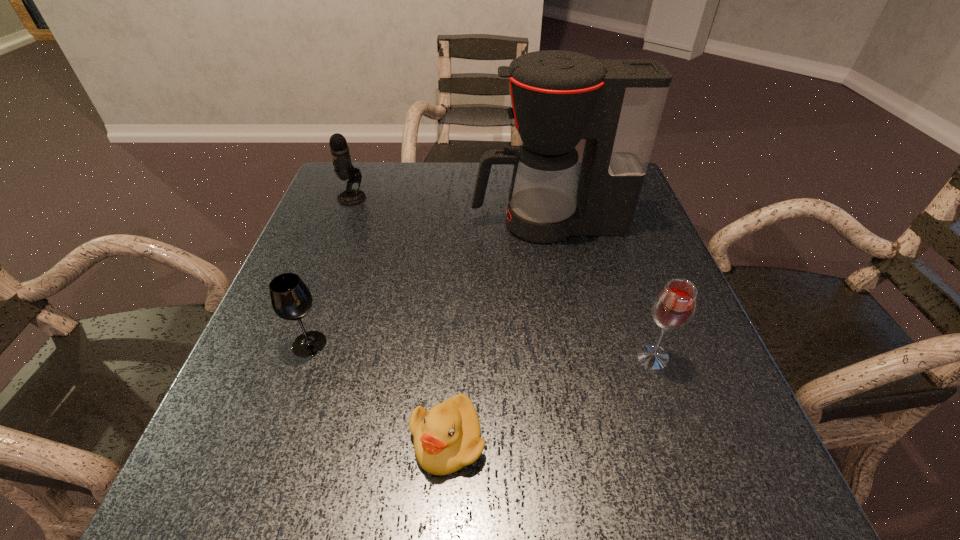
Where is `vacant space located on the left of the right wineglass`? The image size is (960, 540). vacant space located on the left of the right wineglass is located at coordinates (423, 357).

I want to click on vacant area located on the front of the left wineglass, so pyautogui.click(x=284, y=413).

The height and width of the screenshot is (540, 960). I want to click on free location located on the front-facing side of the shortest object, so click(444, 515).

Where is `coffee maker that is at the far edge`? coffee maker that is at the far edge is located at coordinates (558, 97).

Locate an element on the screen. The image size is (960, 540). microphone located in the far edge section of the desktop is located at coordinates (344, 169).

You are a GUI agent. You are given a task and a screenshot of the screen. Output one action in this format:
    pyautogui.click(x=<x>, y=<y>)
    Task: Click on the object that is at the near edge
    The height and width of the screenshot is (540, 960).
    Given the screenshot: What is the action you would take?
    pyautogui.click(x=447, y=438)

Identify the location of microphone at the left edge. (344, 169).

This screenshot has height=540, width=960. What are the coordinates of `wineglass at the left edge` in the screenshot? It's located at (290, 298).

I want to click on coffee maker that is at the right edge, so click(x=558, y=97).

Image resolution: width=960 pixels, height=540 pixels. Identify the location of wineglass at the right edge. (673, 308).